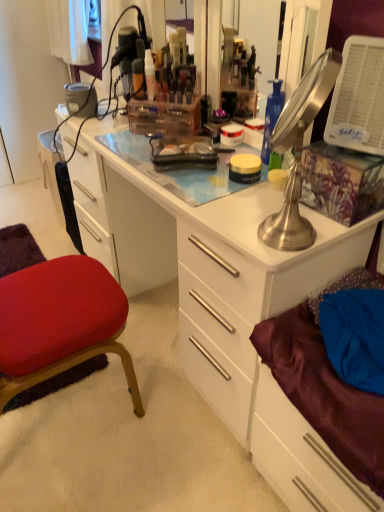
Question: Can you confirm if satin purple drawer at lower right is bigger than metallic silver lamp at upper right?

Choices:
 (A) no
 (B) yes

Answer: (B)

Question: Is there a large distance between satin purple drawer at lower right and metallic silver lamp at upper right?

Choices:
 (A) no
 (B) yes

Answer: (A)

Question: Is satin purple drawer at lower right oriented towards metallic silver lamp at upper right?

Choices:
 (A) yes
 (B) no

Answer: (B)

Question: Does satin purple drawer at lower right have a lesser height compared to metallic silver lamp at upper right?

Choices:
 (A) no
 (B) yes

Answer: (A)

Question: From a real-world perspective, does satin purple drawer at lower right stand above metallic silver lamp at upper right?

Choices:
 (A) yes
 (B) no

Answer: (B)

Question: Considering the relative positions of translucent plastic container at upper center, acting as the first toiletry starting from the left, and velvet red cushion at lower left in the image provided, is translucent plastic container at upper center, acting as the first toiletry starting from the left, to the left or to the right of velvet red cushion at lower left?

Choices:
 (A) left
 (B) right

Answer: (B)

Question: From the image's perspective, is translucent plastic container at upper center, positioned as the second toiletry in right-to-left order, above or below velvet red cushion at lower left?

Choices:
 (A) above
 (B) below

Answer: (A)

Question: Is translucent plastic container at upper center, positioned as the second toiletry in right-to-left order, inside the boundaries of velvet red cushion at lower left, or outside?

Choices:
 (A) outside
 (B) inside

Answer: (A)

Question: From a real-world perspective, is translucent plastic container at upper center, positioned as the second toiletry in right-to-left order, above or below velvet red cushion at lower left?

Choices:
 (A) below
 (B) above

Answer: (B)

Question: From a real-world perspective, is metallic silver lamp at upper right physically located above or below white glossy desk at center?

Choices:
 (A) below
 (B) above

Answer: (B)

Question: Would you say metallic silver lamp at upper right is to the left or to the right of white glossy desk at center in the picture?

Choices:
 (A) right
 (B) left

Answer: (A)

Question: Considering the positions of point (329, 55) and point (243, 398), is point (329, 55) closer or farther from the camera than point (243, 398)?

Choices:
 (A) closer
 (B) farther

Answer: (A)

Question: Relative to white glossy desk at center, is metallic silver lamp at upper right in front or behind?

Choices:
 (A) front
 (B) behind

Answer: (A)

Question: Is point (289, 143) positioned closer to the camera than point (82, 304)?

Choices:
 (A) farther
 (B) closer

Answer: (B)

Question: Based on their sizes in the image, would you say metallic silver lamp at upper right is bigger or smaller than velvet red cushion at lower left?

Choices:
 (A) small
 (B) big

Answer: (A)